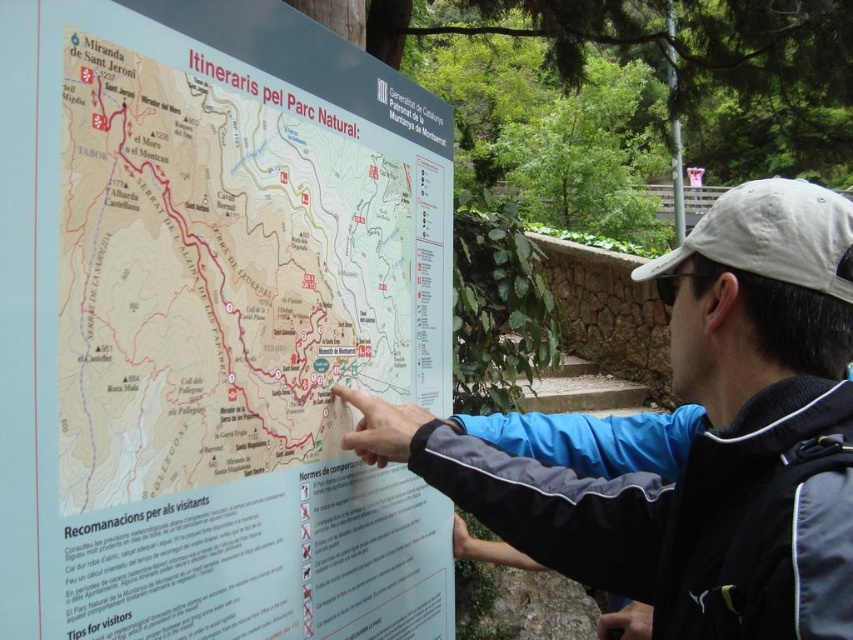
Does light blue plastic sign at center have a larger size compared to blue fabric jacket at center?

Yes.

Between point (397, 608) and point (811, 618), which one is positioned in front?

Point (811, 618) is more forward.

Where is `light blue plastic sign at center`? This screenshot has height=640, width=853. light blue plastic sign at center is located at coordinates (213, 324).